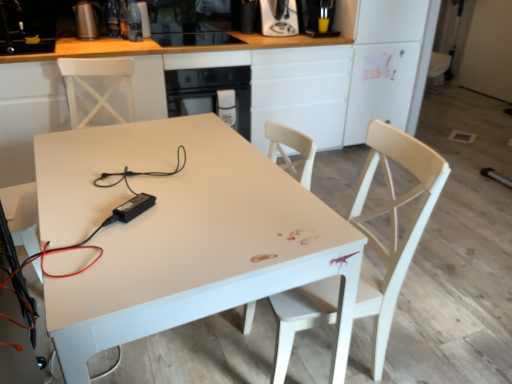
Question: Considering the relative sizes of white glossy cabinet at center and black plastic power adapter at center, the 1th appliance in the right-to-left sequence, in the image provided, is white glossy cabinet at center bigger than black plastic power adapter at center, the 1th appliance in the right-to-left sequence,?

Choices:
 (A) yes
 (B) no

Answer: (A)

Question: Is white glossy cabinet at center facing away from black plastic power adapter at center, acting as the first appliance starting from the front?

Choices:
 (A) yes
 (B) no

Answer: (B)

Question: Can you confirm if white glossy cabinet at center is positioned to the left of black plastic power adapter at center, positioned as the third appliance in top-to-bottom order?

Choices:
 (A) no
 (B) yes

Answer: (B)

Question: Does white glossy cabinet at center lie behind black plastic power adapter at center, acting as the first appliance starting from the front?

Choices:
 (A) yes
 (B) no

Answer: (A)

Question: Considering the relative sizes of white glossy cabinet at center and black plastic power adapter at center, acting as the first appliance starting from the front, in the image provided, is white glossy cabinet at center smaller than black plastic power adapter at center, acting as the first appliance starting from the front,?

Choices:
 (A) yes
 (B) no

Answer: (B)

Question: Based on their positions, is metallic silver kettle at upper left, which is the first appliance from left to right, located to the left or right of black glass oven at center?

Choices:
 (A) left
 (B) right

Answer: (A)

Question: Is point (95, 36) closer or farther from the camera than point (186, 114)?

Choices:
 (A) farther
 (B) closer

Answer: (A)

Question: In terms of width, does metallic silver kettle at upper left, which appears as the second appliance when ordered from the bottom, look wider or thinner when compared to black glass oven at center?

Choices:
 (A) thin
 (B) wide

Answer: (A)

Question: Is metallic silver kettle at upper left, the 3th appliance positioned from the front, situated inside black glass oven at center or outside?

Choices:
 (A) outside
 (B) inside

Answer: (A)

Question: From a real-world perspective, is metallic silver coffee machine at upper right, the 1th coffee machine viewed from the right, physically located above or below black plastic power adapter at center, which is the 1th appliance in bottom-to-top order?

Choices:
 (A) above
 (B) below

Answer: (A)

Question: From the image's perspective, relative to black plastic power adapter at center, positioned as the third appliance in top-to-bottom order, is metallic silver coffee machine at upper right, the 1th coffee machine viewed from the right, above or below?

Choices:
 (A) above
 (B) below

Answer: (A)

Question: Would you say metallic silver coffee machine at upper right, the 1th coffee machine viewed from the right, is to the left or to the right of black plastic power adapter at center, positioned as the third appliance in top-to-bottom order, in the picture?

Choices:
 (A) right
 (B) left

Answer: (A)

Question: Is metallic silver coffee machine at upper right, arranged as the 2th coffee machine when viewed from the left, taller or shorter than black plastic power adapter at center, the 3th appliance from the left?

Choices:
 (A) tall
 (B) short

Answer: (A)

Question: From the image's perspective, is white glossy table at center positioned above or below white glossy cabinet at center?

Choices:
 (A) above
 (B) below

Answer: (B)

Question: In terms of height, does white glossy table at center look taller or shorter compared to white glossy cabinet at center?

Choices:
 (A) short
 (B) tall

Answer: (A)